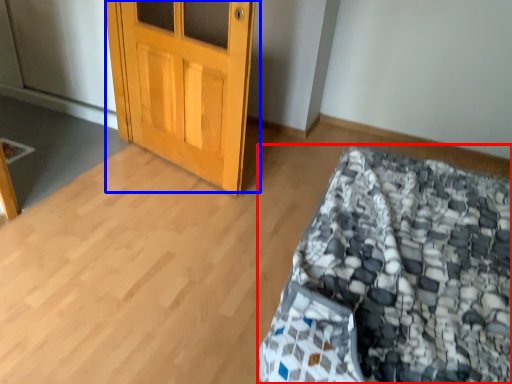
Question: Among these objects, which one is nearest to the camera, bed (highlighted by a red box) or door (highlighted by a blue box)?

Choices:
 (A) bed
 (B) door

Answer: (A)